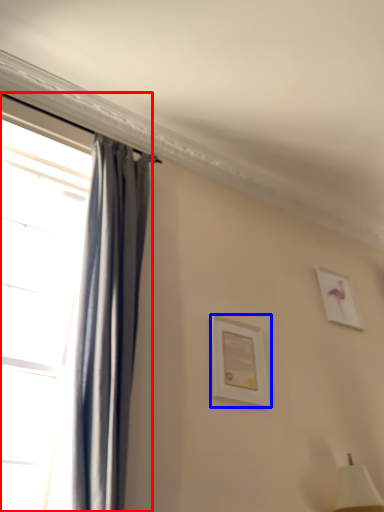
Question: Among these objects, which one is nearest to the camera, window (highlighted by a red box) or picture frame (highlighted by a blue box)?

Choices:
 (A) window
 (B) picture frame

Answer: (A)